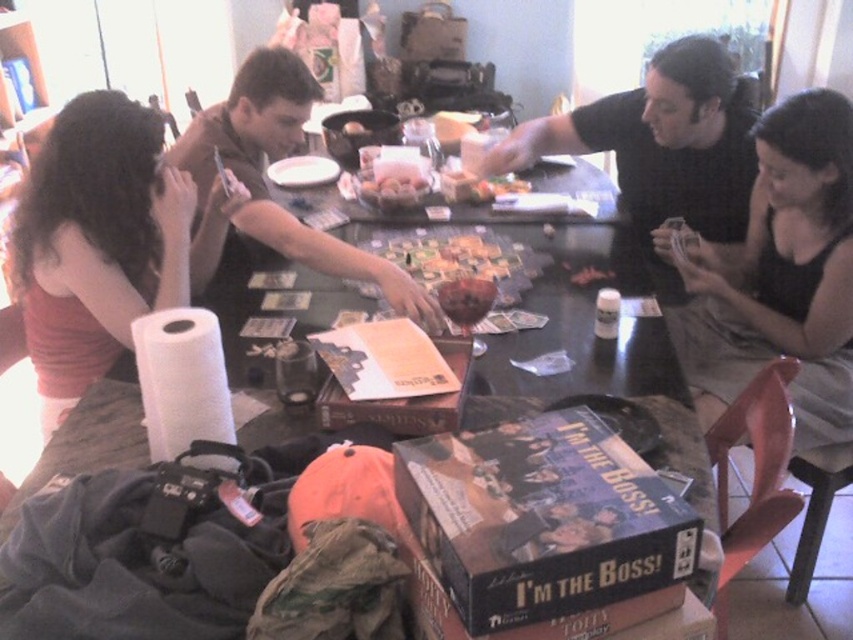
Is black matte shirt at upper right to the right of smooth red apple at center from the viewer's perspective?

Yes, black matte shirt at upper right is to the right of smooth red apple at center.

Who is positioned more to the left, black matte shirt at upper right or smooth red apple at center?

Positioned to the left is smooth red apple at center.

Is point (688, 84) positioned in front of point (450, 280)?

No, (688, 84) is further to viewer.

Image resolution: width=853 pixels, height=640 pixels. I want to click on black matte shirt at upper right, so click(x=662, y=145).

Is matte black shirt at center shorter than smooth red apple at center?

In fact, matte black shirt at center may be taller than smooth red apple at center.

Identify the location of matte black shirt at center. Image resolution: width=853 pixels, height=640 pixels. (277, 157).

Is black fabric dress at lower right below smooth red apple at center?

No.

Is black fabric dress at lower right to the right of smooth red apple at center from the viewer's perspective?

Yes, black fabric dress at lower right is to the right of smooth red apple at center.

Does point (704, 401) come in front of point (489, 301)?

No, it is not.

At what (x,y) coordinates should I click in order to perform the action: click on black fabric dress at lower right. Please return your answer as a coordinate pair (x, y). Looking at the image, I should click on (782, 275).